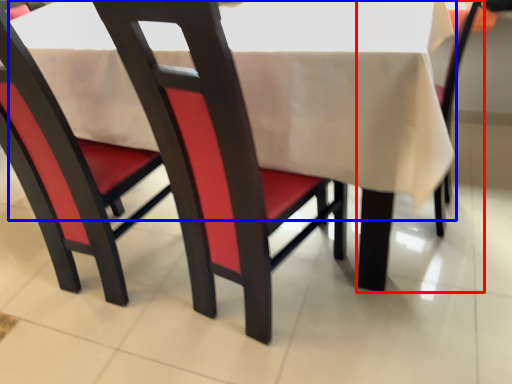
Question: Which point is further to the camera, chair (highlighted by a red box) or tablecloth (highlighted by a blue box)?

Choices:
 (A) chair
 (B) tablecloth

Answer: (A)